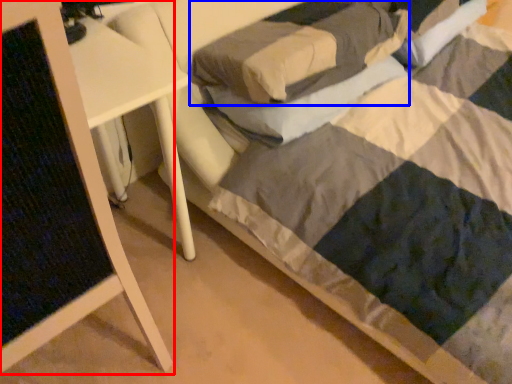
Question: Which of the following is the farthest to the observer, furniture (highlighted by a red box) or pillow (highlighted by a blue box)?

Choices:
 (A) furniture
 (B) pillow

Answer: (B)